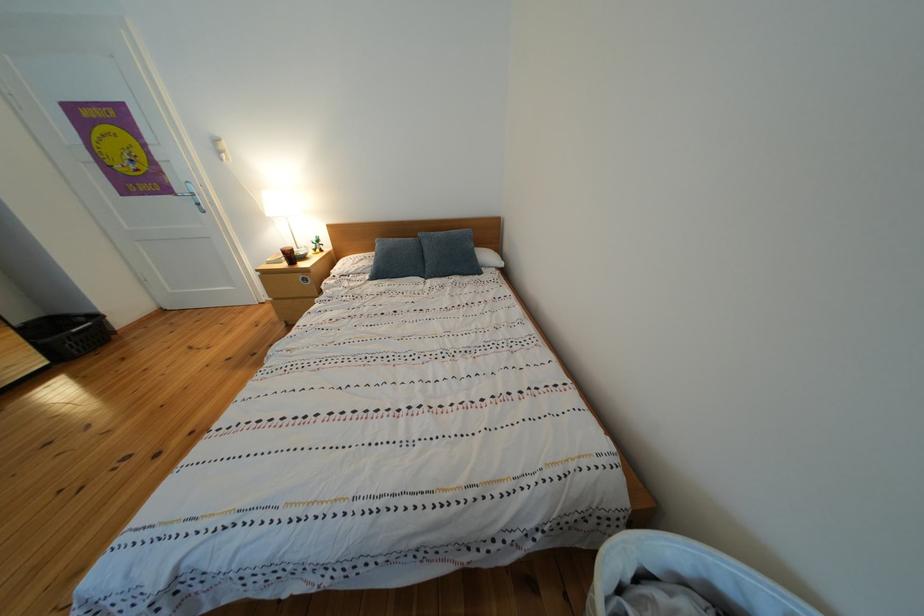
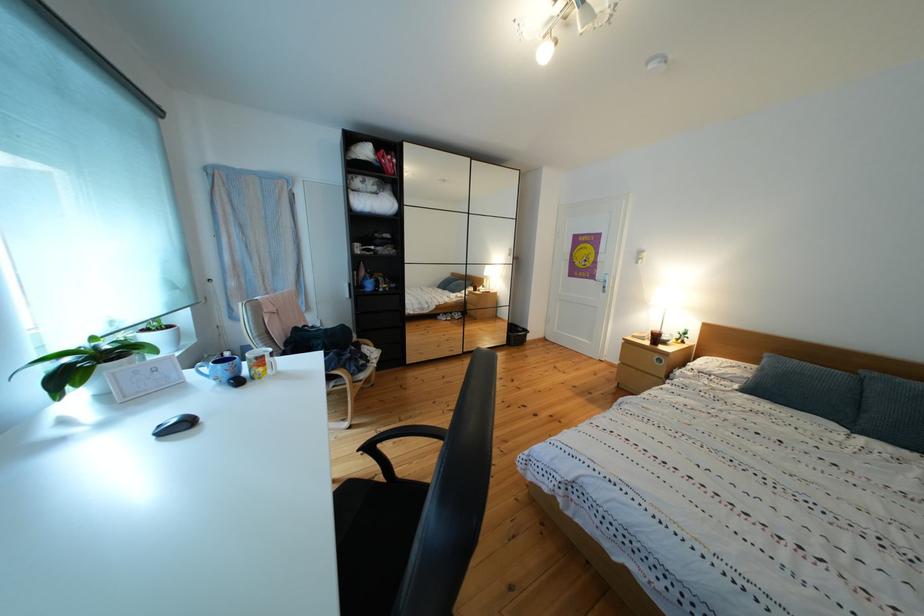
Find the pixel in the second image that matches [438,281] in the first image.

(867, 434)